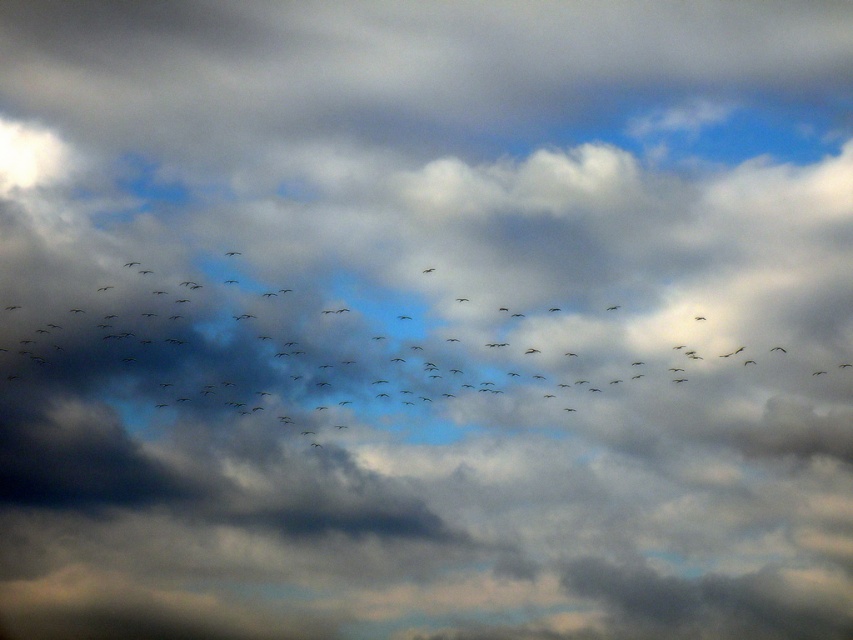
You are an ornithologist observing the flock of birds in the image. You notice two distinct birds in the center of the frame. Which one is more likely to be a predator based on their size? Please refer to the birds labeled as black matte birds at center and dark gray feathered bird at center.

The black matte birds at center is larger in size than the dark gray feathered bird at center, so it is more likely to be a predator.

You are a photographer trying to capture the flock of birds flying towards the upper right corner. You notice two points in the scene labeled as point 1 at coordinates point 1 at point (78, 316) and point 2 at point (432, 268). Which point is closer to your camera lens?

Point 1 at point (78, 316) is closer to the camera lens because it is further to the camera than point 2 at point (432, 268).